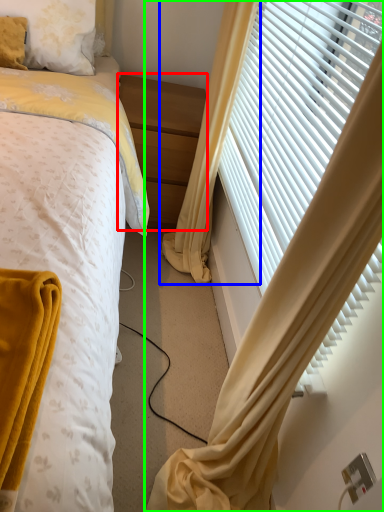
Question: Which object is the farthest from nightstand (highlighted by a red box)? Choose among these: curtain (highlighted by a blue box) or curtain (highlighted by a green box).

Choices:
 (A) curtain
 (B) curtain

Answer: (B)